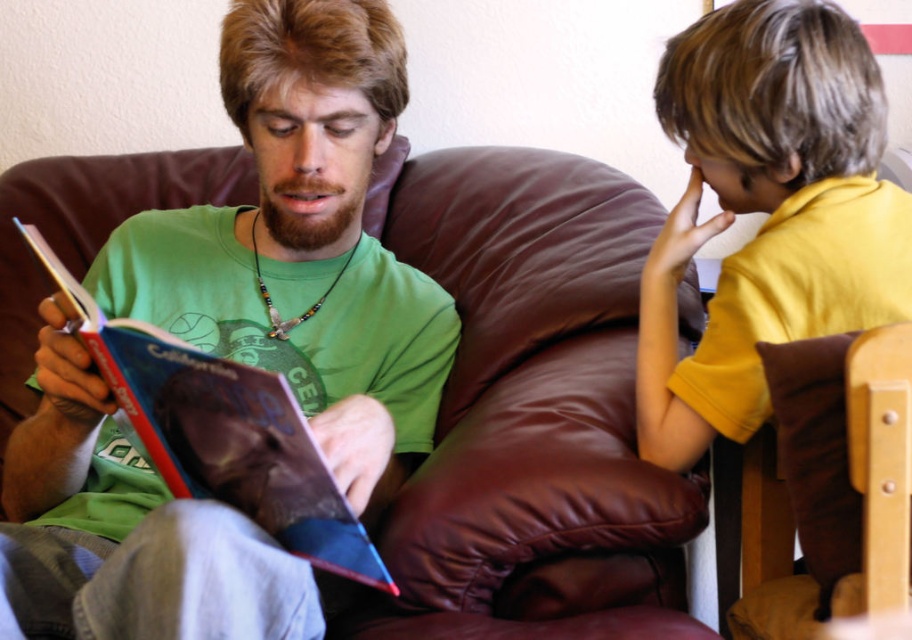
You are standing in the room and see two points marked in the image. Which point is closer to you, point (546, 332) or point (862, 234)?

Point (862, 234) is closer to you because point (546, 332) is behind it.